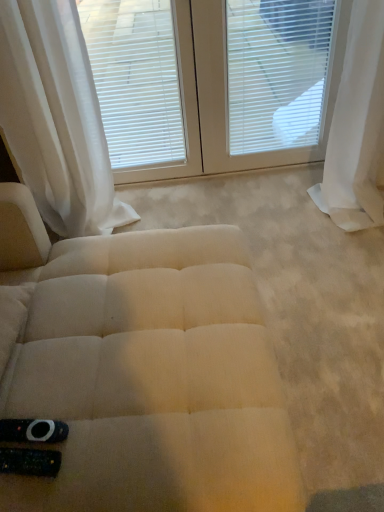
This screenshot has width=384, height=512. In order to click on vacant area that is in front of white sheer curtain at right, the first curtain viewed from the right in this screenshot , I will do `click(353, 255)`.